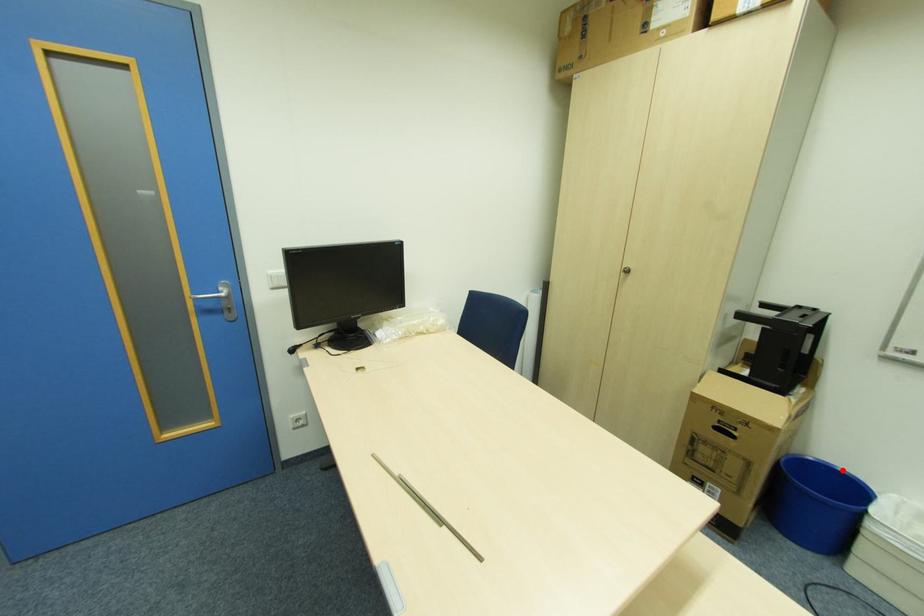
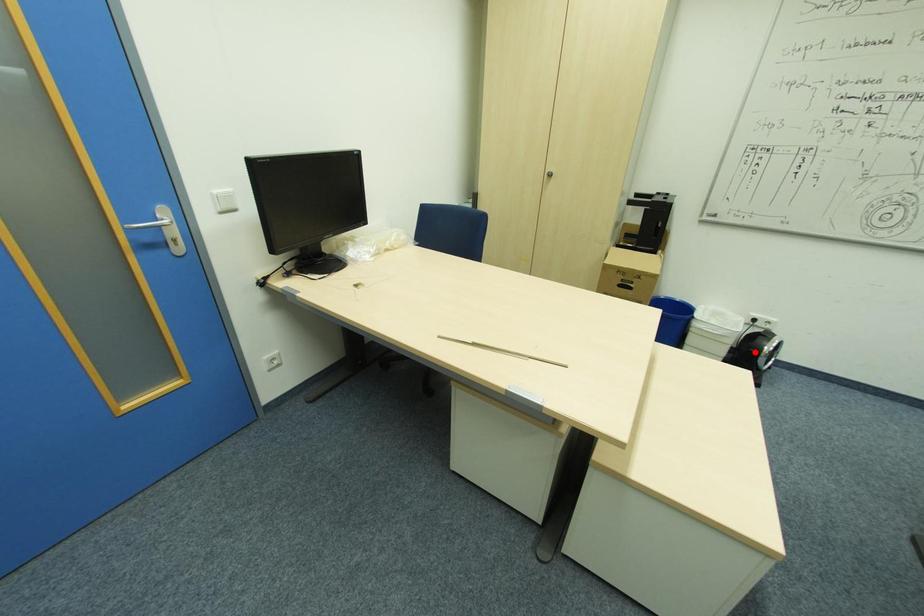
I am providing you with two images of the same scene from different viewpoints. A red point is marked on the first image and another point is marked on the second image. Is the red point in image1 aligned with the point shown in image2?

No